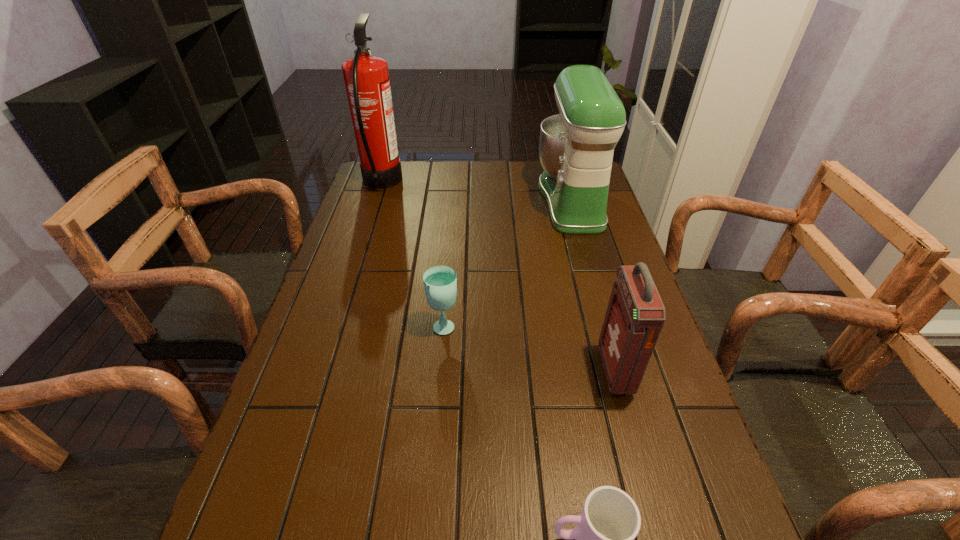
Locate an element on the screen. vacant space located 0.170m on the controls of the second tallest object is located at coordinates (489, 200).

In order to click on vacant space situated 0.130m on the front-facing side of the first-aid kit in this screenshot , I will do `click(547, 370)`.

Find the location of a particular element. free spot located 0.340m on the front-facing side of the first-aid kit is located at coordinates (455, 370).

Where is `vacant space located 0.150m on the front-facing side of the first-aid kit`? The width and height of the screenshot is (960, 540). vacant space located 0.150m on the front-facing side of the first-aid kit is located at coordinates (538, 370).

At what (x,y) coordinates should I click in order to perform the action: click on vacant space situated on the front of the glass. Please return your answer as a coordinate pair (x, y). Looking at the image, I should click on (441, 367).

Locate an element on the screen. This screenshot has width=960, height=540. fire extinguisher that is at the far edge is located at coordinates (366, 77).

This screenshot has height=540, width=960. I want to click on mixer present at the far edge, so click(x=576, y=147).

This screenshot has height=540, width=960. What are the coordinates of `object located at the left edge` in the screenshot? It's located at (366, 77).

This screenshot has width=960, height=540. Find the location of `mixer present at the right edge`. mixer present at the right edge is located at coordinates (576, 147).

Find the location of a particular element. The image size is (960, 540). the first-aid kit situated at the right edge is located at coordinates (635, 315).